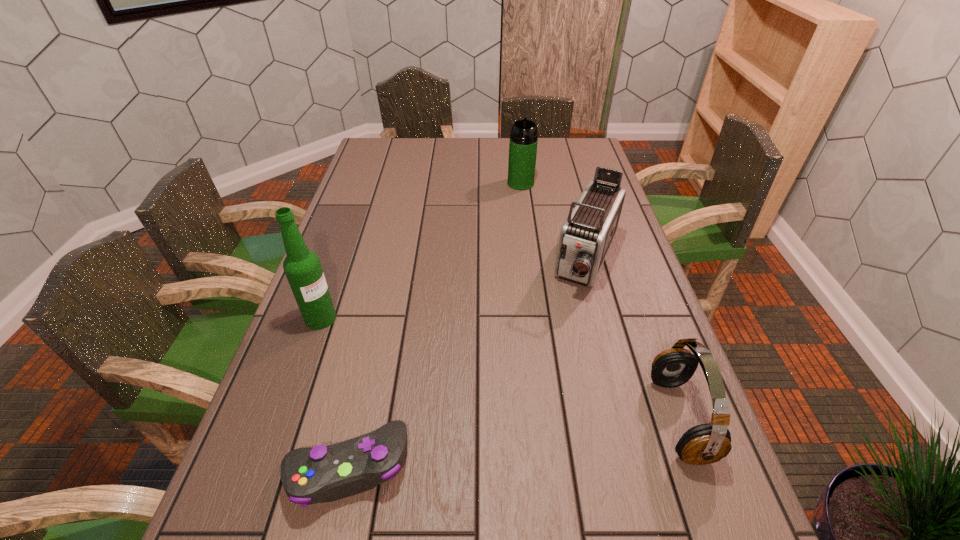
I want to click on control, so click(321, 474).

Find the location of `the fourth tallest object`. the fourth tallest object is located at coordinates (708, 443).

In order to click on the farthest object in this screenshot , I will do `click(523, 139)`.

Where is `thermos bottle`? thermos bottle is located at coordinates (523, 139).

I want to click on beer bottle, so click(302, 267).

Identify the location of the third farthest object. (302, 267).

Locate an element on the screen. the fourth nearest object is located at coordinates (586, 236).

At what (x,y) coordinates should I click in order to perform the action: click on vacant space located on the back of the control. Please return your answer as a coordinate pair (x, y). Looking at the image, I should click on (375, 334).

Identify the location of free region located from the spout of the third object from left to right. (522, 213).

The width and height of the screenshot is (960, 540). I want to click on free space located from the spout of the third object from left to right, so click(x=524, y=241).